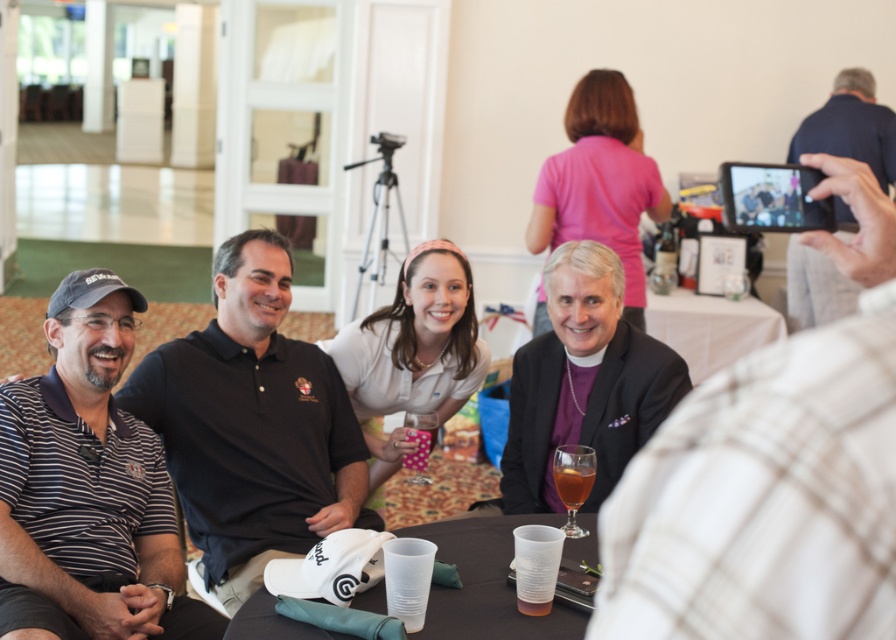
Who is positioned more to the right, white plastic cups at lower center or white cloth table at center?

white cloth table at center

From the picture: Who is positioned more to the left, white plastic cups at lower center or white cloth table at center?

white plastic cups at lower center is more to the left.

Where is `white plastic cups at lower center`? white plastic cups at lower center is located at coordinates (487, 582).

Who is higher up, striped polo shirt at left or dark brown polo shirt at left?

dark brown polo shirt at left

Can you confirm if striped polo shirt at left is shorter than dark brown polo shirt at left?

Yes.

Between point (88, 296) and point (303, 419), which one is positioned behind?

The point (303, 419) is behind.

Identify the location of striped polo shirt at left. (87, 488).

Is dark blue shirt at upper right smaller than white cloth table at center?

Indeed, dark blue shirt at upper right has a smaller size compared to white cloth table at center.

Which is in front, point (838, 296) or point (683, 346)?

Positioned in front is point (683, 346).

Locate an element on the screen. The width and height of the screenshot is (896, 640). dark blue shirt at upper right is located at coordinates (850, 125).